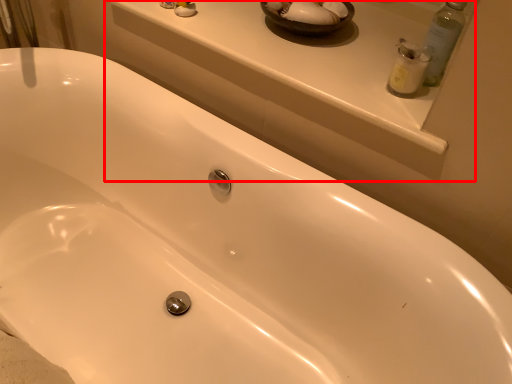
Question: From the image, what is the correct spatial relationship of window sill (annotated by the red box) in relation to cleaning product?

Choices:
 (A) left
 (B) right

Answer: (A)